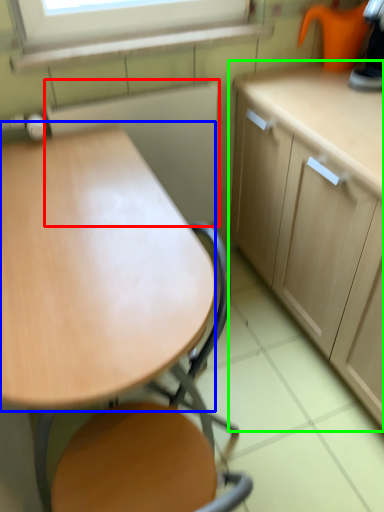
Question: Which object is the closest to the appliance (highlighted by a red box)? Choose among these: round table (highlighted by a blue box) or cabinetry (highlighted by a green box).

Choices:
 (A) round table
 (B) cabinetry

Answer: (B)